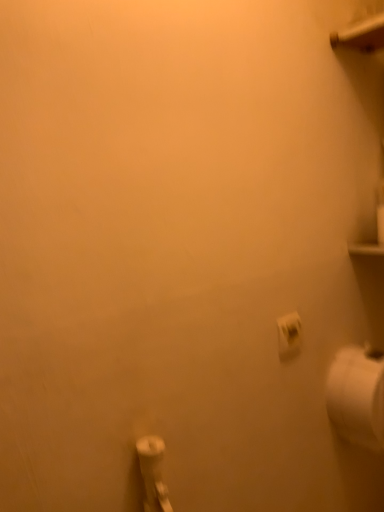
Question: Is white matte toilet paper at right, placed as the second toilet paper when sorted from front to back, turned away from white matte toilet paper at lower right, acting as the 1th toilet paper starting from the top?

Choices:
 (A) no
 (B) yes

Answer: (A)

Question: Is white matte toilet paper at right, the 1th toilet paper when ordered from right to left, shorter than white matte toilet paper at lower right, acting as the 1th toilet paper starting from the top?

Choices:
 (A) yes
 (B) no

Answer: (B)

Question: Is white matte toilet paper at right, arranged as the first toilet paper when viewed from the back, facing towards white matte toilet paper at lower right, which is the first toilet paper from front to back?

Choices:
 (A) yes
 (B) no

Answer: (B)

Question: Would you say white matte toilet paper at right, the 1th toilet paper when ordered from right to left, is outside white matte toilet paper at lower right, which is the first toilet paper from front to back?

Choices:
 (A) no
 (B) yes

Answer: (B)

Question: Is white matte toilet paper at right, the second toilet paper from the left, wider than white matte toilet paper at lower right, the second toilet paper in the back-to-front sequence?

Choices:
 (A) yes
 (B) no

Answer: (A)

Question: Does white matte toilet paper at right, the 1th toilet paper when ordered from right to left, touch white matte toilet paper at lower right, the second toilet paper ordered from the bottom?

Choices:
 (A) no
 (B) yes

Answer: (A)

Question: Is white matte toilet paper at lower right, which is the first toilet paper from front to back, thinner than white matte toilet paper at right, the second toilet paper from the left?

Choices:
 (A) no
 (B) yes

Answer: (B)

Question: Considering the relative positions of white matte toilet paper at lower right, the second toilet paper ordered from the bottom, and white matte toilet paper at right, arranged as the first toilet paper when viewed from the back, in the image provided, is white matte toilet paper at lower right, the second toilet paper ordered from the bottom, to the right of white matte toilet paper at right, arranged as the first toilet paper when viewed from the back, from the viewer's perspective?

Choices:
 (A) yes
 (B) no

Answer: (B)

Question: Can you confirm if white matte toilet paper at lower right, the second toilet paper ordered from the bottom, is taller than white matte toilet paper at right, which is counted as the first toilet paper, starting from the bottom?

Choices:
 (A) yes
 (B) no

Answer: (B)

Question: Does white matte toilet paper at lower right, marked as the 1th toilet paper in a left-to-right arrangement, have a larger size compared to white matte toilet paper at right, the 2th toilet paper when ordered from top to bottom?

Choices:
 (A) no
 (B) yes

Answer: (A)

Question: Would you say white matte toilet paper at right, which is counted as the first toilet paper, starting from the bottom, is part of white matte toilet paper at lower right, the second toilet paper ordered from the bottom,'s contents?

Choices:
 (A) no
 (B) yes

Answer: (A)

Question: From the image's perspective, would you say white matte toilet paper at lower right, which is the first toilet paper from front to back, is shown under white matte toilet paper at right, the 2th toilet paper when ordered from top to bottom?

Choices:
 (A) no
 (B) yes

Answer: (A)

Question: From the image's perspective, is white matte toilet paper at lower right, acting as the 1th toilet paper starting from the top, positioned above or below white matte toilet paper at right, the 2th toilet paper when ordered from top to bottom?

Choices:
 (A) above
 (B) below

Answer: (A)